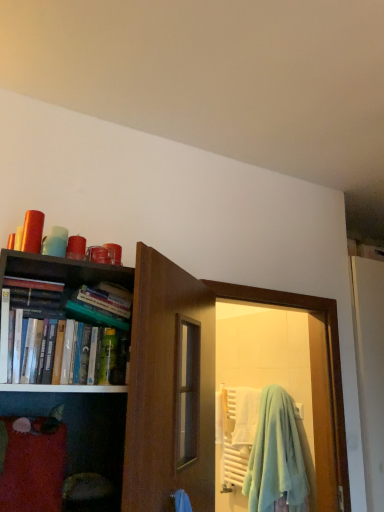
Describe the element at coordinates (58, 325) in the screenshot. I see `hardcover books at left` at that location.

This screenshot has height=512, width=384. In order to click on hardcover books at left in this screenshot , I will do click(58, 325).

Consider the image. Are light blue fleece beach towel at door and hardcover books at left beside each other?

They are not placed beside each other.

Looking at the image, does light blue fleece beach towel at door seem bigger or smaller compared to hardcover books at left?

light blue fleece beach towel at door is bigger than hardcover books at left.

Which is behind, point (228, 450) or point (72, 331)?

The point (228, 450) is more distant.

From the image's perspective, who appears lower, light blue fleece beach towel at door or hardcover books at left?

light blue fleece beach towel at door appears lower in the image.

Looking at their sizes, would you say green plastic bottle at center is wider or thinner than light blue fleece beach towel at door?

green plastic bottle at center is thinner than light blue fleece beach towel at door.

Would you say green plastic bottle at center is a long distance from light blue fleece beach towel at door?

Yes, green plastic bottle at center and light blue fleece beach towel at door are located far from each other.

This screenshot has height=512, width=384. Identify the location of beach towel lying below the green plastic bottle at center (from the image's perspective). (233, 464).

Does green plastic bottle at center appear on the left side of light blue fleece beach towel at door?

Yes.

Considering the sizes of hardcover books at left and green plastic bottle at center in the image, is hardcover books at left taller or shorter than green plastic bottle at center?

Clearly, hardcover books at left is taller compared to green plastic bottle at center.

What are the coordinates of `toiletry that appears behind the hardcover books at left` in the screenshot? It's located at (108, 357).

Would you say hardcover books at left is outside green plastic bottle at center?

hardcover books at left lies outside green plastic bottle at center's area.

In the scene shown: Is hardcover books at left looking in the opposite direction of green plastic bottle at center?

Yes, green plastic bottle at center is at the back of hardcover books at left.

Is point (70, 302) closer or farther from the camera than point (223, 437)?

Point (70, 302) is closer to the camera than point (223, 437).

Is hardcover books at left bigger than light blue fleece beach towel at door?

No.

In the scene shown: Between hardcover books at left and light blue fleece beach towel at door, which one is positioned in front?

hardcover books at left is closer to the camera.

Looking at this image, from the image's perspective, is hardcover books at left on top of light blue fleece beach towel at door?

Yes, from the image's perspective, hardcover books at left is on top of light blue fleece beach towel at door.

Does light blue fleece beach towel at door come in front of green plastic bottle at center?

No, light blue fleece beach towel at door is behind green plastic bottle at center.

Does light blue fleece beach towel at door appear on the left side of green plastic bottle at center?

No.

From the picture: How distant is light blue fleece beach towel at door from green plastic bottle at center?

light blue fleece beach towel at door is 5.57 feet from green plastic bottle at center.

Would you consider light blue fleece beach towel at door to be distant from green plastic bottle at center?

Yes, light blue fleece beach towel at door and green plastic bottle at center are located far from each other.

Considering the sizes of objects green plastic bottle at center and hardcover books at left in the image provided, who is smaller, green plastic bottle at center or hardcover books at left?

green plastic bottle at center.

Can you confirm if green plastic bottle at center is thinner than hardcover books at left?

Indeed, green plastic bottle at center has a lesser width compared to hardcover books at left.

Can you confirm if green plastic bottle at center is positioned to the left of hardcover books at left?

No.

Between green plastic bottle at center and hardcover books at left, which one has less height?

green plastic bottle at center is shorter.

This screenshot has width=384, height=512. I want to click on beach towel that appears behind the hardcover books at left, so click(233, 464).

The height and width of the screenshot is (512, 384). Find the location of `toiletry that is above the light blue fleece beach towel at door (from a real-world perspective)`. toiletry that is above the light blue fleece beach towel at door (from a real-world perspective) is located at coordinates (108, 357).

Based on the photo, estimate the real-world distances between objects in this image. Which object is closer to hardcover books at left, green plastic bottle at center or light blue fleece beach towel at door?

green plastic bottle at center is closer to hardcover books at left.

Estimate the real-world distances between objects in this image. Which object is further from hardcover books at left, light blue fleece beach towel at door or green plastic bottle at center?

light blue fleece beach towel at door is positioned further to the anchor hardcover books at left.

Considering their positions, is hardcover books at left positioned further to green plastic bottle at center than light blue fleece beach towel at door?

Based on the image, light blue fleece beach towel at door appears to be further to green plastic bottle at center.

From the image, which object appears to be nearer to light blue fleece beach towel at door, hardcover books at left or green plastic bottle at center?

green plastic bottle at center.

Looking at the image, which one is located closer to green plastic bottle at center, light blue fleece beach towel at door or hardcover books at left?

Among the two, hardcover books at left is located nearer to green plastic bottle at center.

When comparing their distances from light blue fleece beach towel at door, does green plastic bottle at center or hardcover books at left seem further?

hardcover books at left is further to light blue fleece beach towel at door.

Where is `toiletry between hardcover books at left and light blue fleece beach towel at door from front to back`? This screenshot has height=512, width=384. toiletry between hardcover books at left and light blue fleece beach towel at door from front to back is located at coordinates (108, 357).